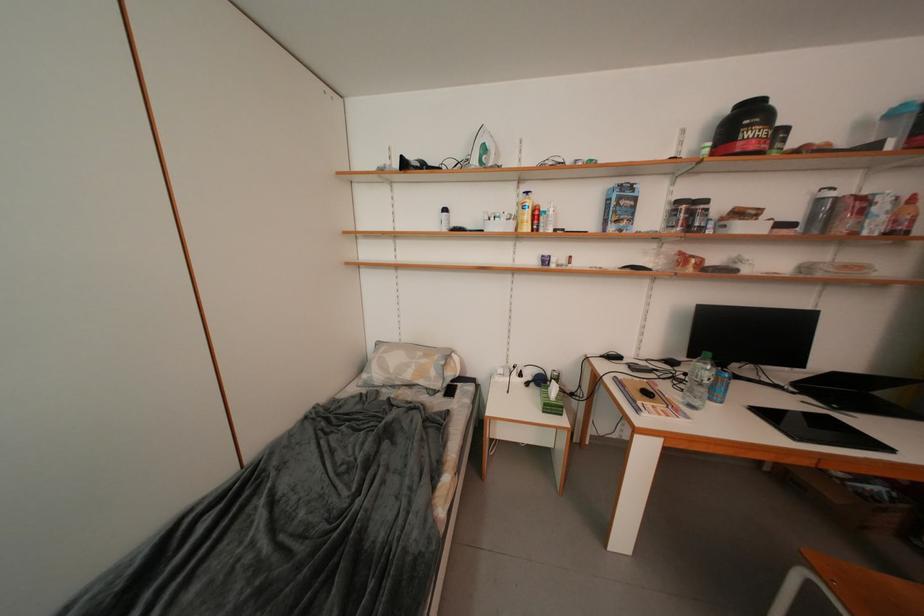
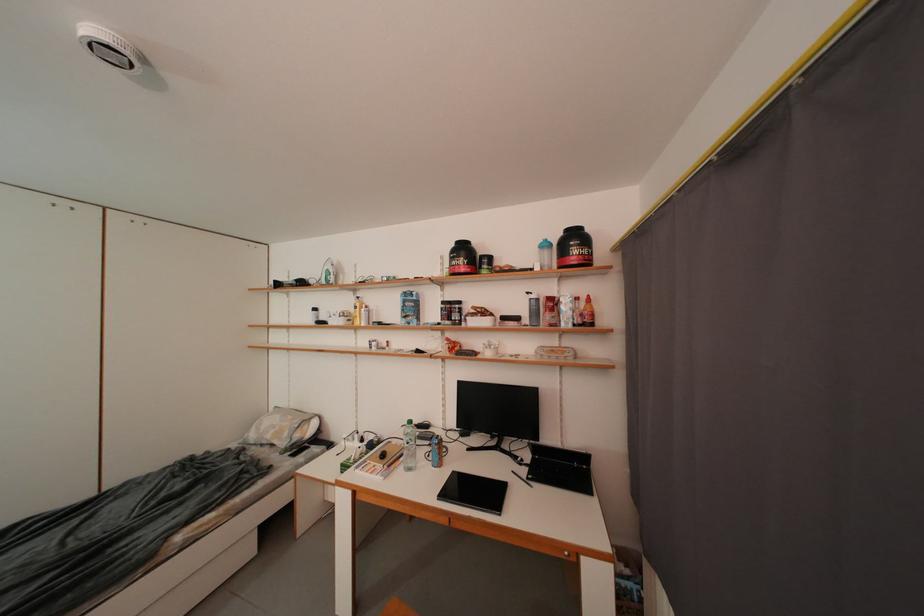
Find the pixel in the second image that matches (x=654, y=397) in the first image.

(391, 459)